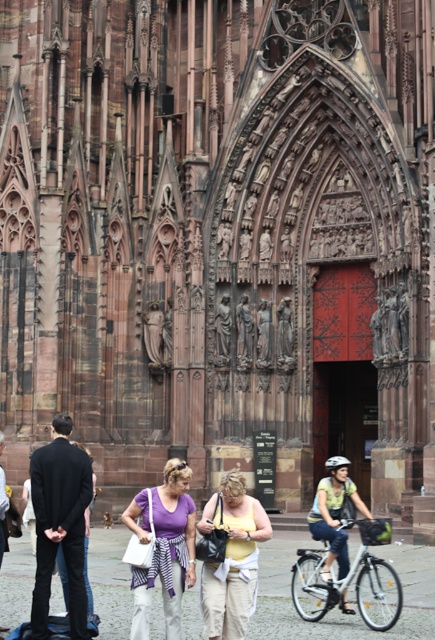
You are standing in front of the cathedral and want to take a photo that includes both point A at point (350, 580) and point B at point (221, 328). Which point is closer to you when you take the photo?

Point A at point (350, 580) is closer to you than point B at point (221, 328).

You are standing in front of the cathedral and see the point marked at coordinates (167, 552). What object or feature does this point indicate?

The point at coordinates (167, 552) marks the purple fabric shirt at center.

You are standing at the entrance of the cathedral and see the purple fabric shirt at center and the dark gray jacket at lower left. Which person is closer to the cathedral entrance?

The dark gray jacket at lower left is closer to the cathedral entrance because it is positioned to the left of the purple fabric shirt at center, which is further to the right.